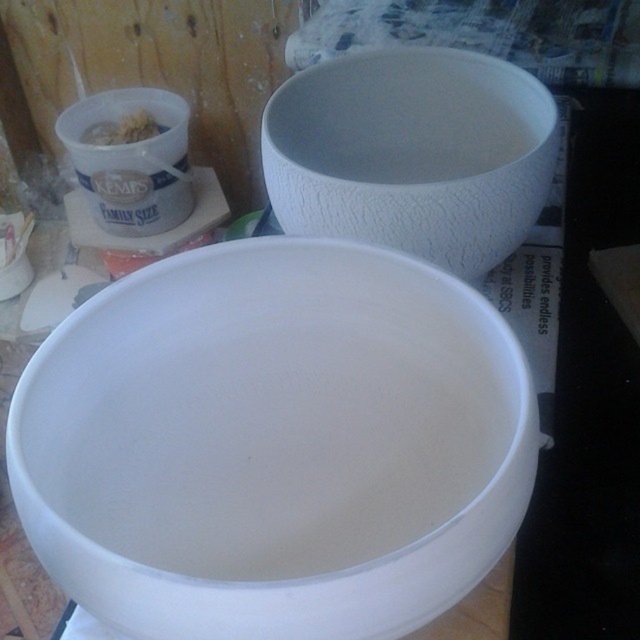
You are planning to serve a dessert and need to choose between the white matte bowl at center and the white textured bowl at upper center. Which bowl should you pick if you want the larger one?

The white matte bowl at center is larger in size than the white textured bowl at upper center, so you should choose the white matte bowl at center for the larger option.

You are setting up a table for a dessert tasting event. You need to stack the white matte bowl at center and the white textured bowl at upper center vertically. Which bowl should you place at the bottom to ensure stability?

To ensure stability when stacking the white matte bowl at center and the white textured bowl at upper center, place the taller white textured bowl at upper center at the bottom since it is taller and thus more stable. The shorter white matte bowl at center should go on top.

You are standing at the edge of the table where the two bowls and the Kemps container are placed. You want to reach for the point closer to you between point (106, 545) and point (400, 184). Which point should you reach for?

You should reach for point (106, 545) because it is in front of point (400, 184), making it closer to your position at the edge of the table.